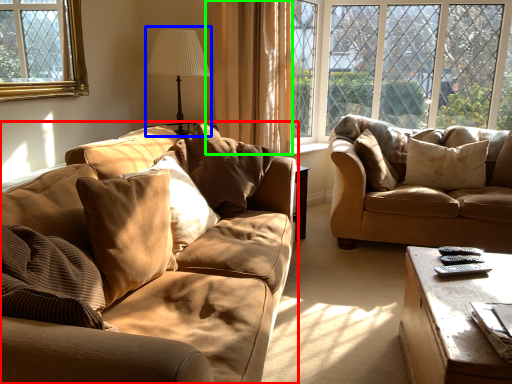
Question: Estimate the real-world distances between objects in this image. Which object is closer to studio couch (highlighted by a red box), table lamp (highlighted by a blue box) or curtain (highlighted by a green box)?

Choices:
 (A) table lamp
 (B) curtain

Answer: (B)